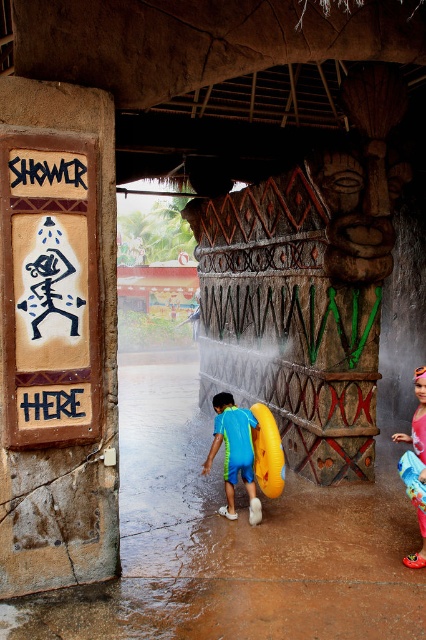
You are at the water park and need to locate the shower facilities. You see the matte brown sign at left and the black wood sign at upper left. According to their positions, which sign is closer to the ground?

The matte brown sign at left is positioned under the black wood sign at upper left, so the matte brown sign at left is closer to the ground.

You are standing at the entrance of the shower area and want to locate the shower facilities. Which sign should you look for first, the matte brown sign at left or the black wood sign at upper left, based on their positions?

You should look for the black wood sign at upper left first because the matte brown sign at left is to the right of it, meaning the black wood sign at upper left is positioned to the left of the matte brown sign at left.